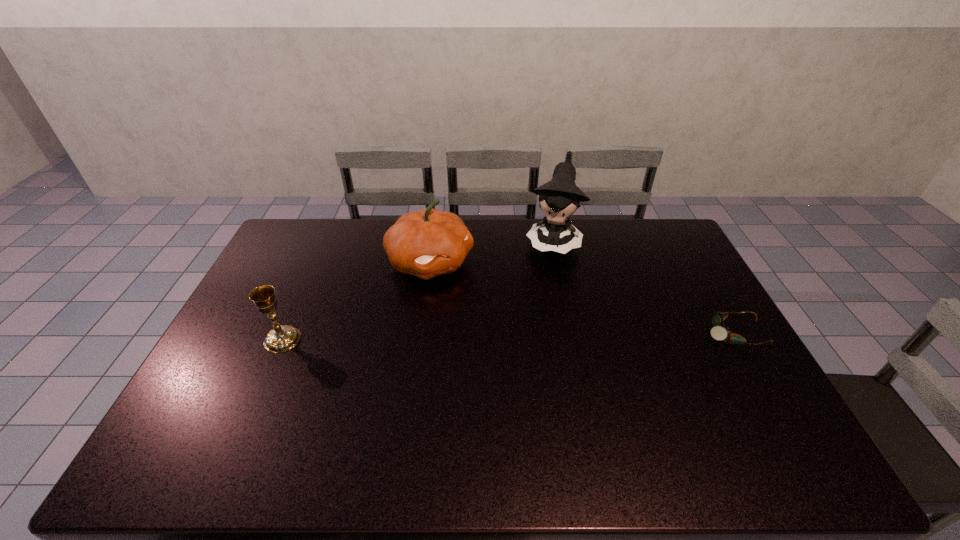
This screenshot has width=960, height=540. Find the location of `free spot on the desktop that is between the chalice and the shortest object and is positioned on the front face of the third shortest object`. free spot on the desktop that is between the chalice and the shortest object and is positioned on the front face of the third shortest object is located at coordinates (541, 336).

Identify the location of vacant space on the desktop that is between the leftmost object and the spectacles and is positioned at the face of the second object from right to left. The height and width of the screenshot is (540, 960). (527, 336).